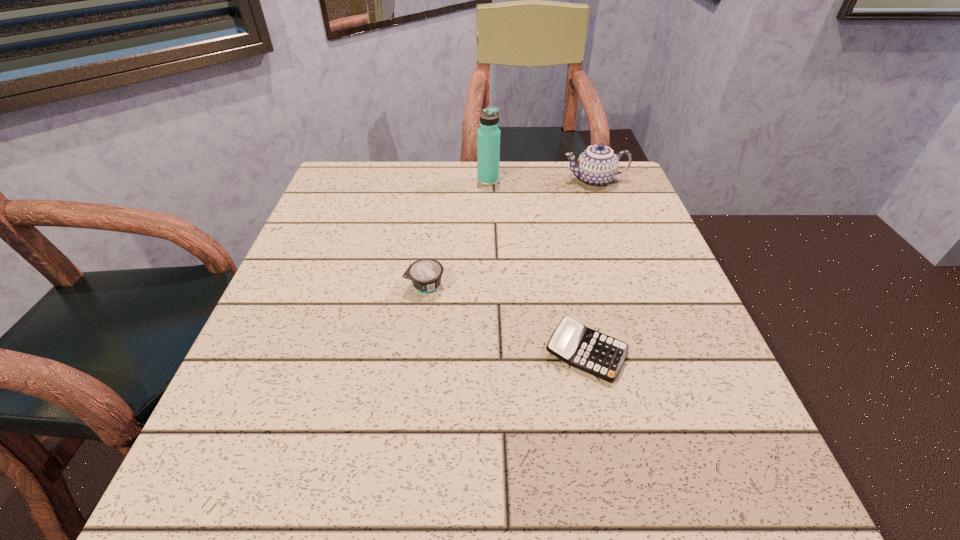
Find the location of a particular element. Image resolution: width=960 pixels, height=540 pixels. thermos bottle is located at coordinates (488, 135).

Locate an element on the screen. This screenshot has height=540, width=960. the tallest object is located at coordinates (488, 135).

Image resolution: width=960 pixels, height=540 pixels. What are the coordinates of `chinaware` in the screenshot? It's located at (597, 166).

This screenshot has width=960, height=540. In order to click on yogurt in this screenshot , I will do `click(425, 274)`.

Identify the location of the second nearest object. (425, 274).

At what (x,y) coordinates should I click in order to perform the action: click on the nearest object. Please return your answer as a coordinate pair (x, y). Looking at the image, I should click on (598, 354).

Identify the location of calculator. This screenshot has height=540, width=960. (598, 354).

Locate an element on the screen. This screenshot has height=540, width=960. free region located on the back of the third object from right to left is located at coordinates (488, 164).

At what (x,y) coordinates should I click in order to perform the action: click on vacant region located from the spout of the second tallest object. Please return your answer as a coordinate pair (x, y). Looking at the image, I should click on (521, 180).

Locate an element on the screen. free region located from the spout of the second tallest object is located at coordinates (477, 180).